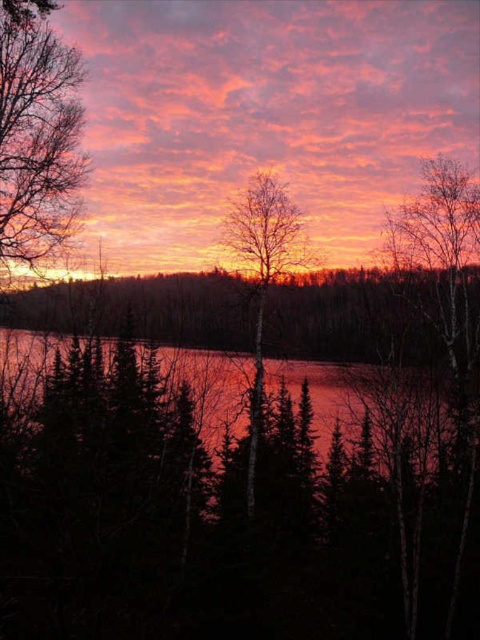
Based on the photo, does dark red water at center come in front of bare birch tree at center?

That is True.

Does dark red water at center have a smaller size compared to bare birch tree at center?

Actually, dark red water at center might be larger than bare birch tree at center.

What do you see at coordinates (371, 403) in the screenshot? This screenshot has width=480, height=640. I see `dark red water at center` at bounding box center [371, 403].

Locate an element on the screen. dark red water at center is located at coordinates (371, 403).